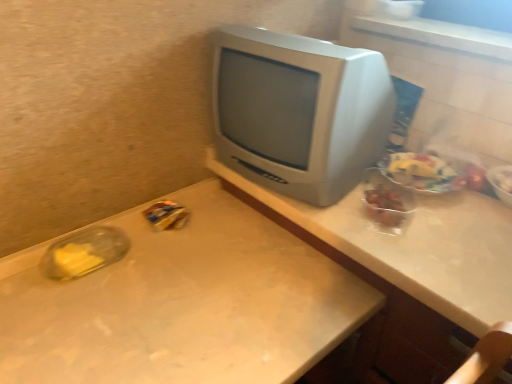
Question: From a real-world perspective, is translucent plastic container at right, which is counted as the third food, starting from the right, on translucent plastic bowl at upper right, the fourth food in the left-to-right sequence?

Choices:
 (A) yes
 (B) no

Answer: (B)

Question: Considering the relative sizes of translucent plastic container at right, which appears as the 2th food when viewed from the left, and translucent plastic bowl at upper right, the fourth food in the left-to-right sequence, in the image provided, is translucent plastic container at right, which appears as the 2th food when viewed from the left, taller than translucent plastic bowl at upper right, the fourth food in the left-to-right sequence,?

Choices:
 (A) no
 (B) yes

Answer: (A)

Question: From the image's perspective, is translucent plastic container at right, which appears as the 2th food when viewed from the left, on top of translucent plastic bowl at upper right, the fourth food in the left-to-right sequence?

Choices:
 (A) no
 (B) yes

Answer: (A)

Question: Can you confirm if translucent plastic container at right, which appears as the 2th food when viewed from the left, is thinner than translucent plastic bowl at upper right, the 1th food in the right-to-left sequence?

Choices:
 (A) no
 (B) yes

Answer: (A)

Question: Does translucent plastic container at right, which is counted as the third food, starting from the right, appear on the left side of translucent plastic bowl at upper right, the fourth food in the left-to-right sequence?

Choices:
 (A) yes
 (B) no

Answer: (A)

Question: Does translucent plastic container at right, which is counted as the third food, starting from the right, have a greater width compared to translucent plastic bowl at upper right, the fourth food in the left-to-right sequence?

Choices:
 (A) yes
 (B) no

Answer: (A)

Question: Would you say translucent plastic bowl at upper right, the fourth food in the left-to-right sequence, is a long distance from yellow plastic bag at center-left, which appears as the 4th food when viewed from the right?

Choices:
 (A) yes
 (B) no

Answer: (B)

Question: Is translucent plastic bowl at upper right, the 1th food in the right-to-left sequence, facing away from yellow plastic bag at center-left, which appears as the 4th food when viewed from the right?

Choices:
 (A) yes
 (B) no

Answer: (B)

Question: From the image's perspective, does translucent plastic bowl at upper right, the fourth food in the left-to-right sequence, appear higher than yellow plastic bag at center-left, which is counted as the first food, starting from the left?

Choices:
 (A) no
 (B) yes

Answer: (B)

Question: Can you see translucent plastic bowl at upper right, the fourth food in the left-to-right sequence, touching yellow plastic bag at center-left, which appears as the 4th food when viewed from the right?

Choices:
 (A) no
 (B) yes

Answer: (A)

Question: From a real-world perspective, is translucent plastic bowl at upper right, the fourth food in the left-to-right sequence, positioned under yellow plastic bag at center-left, which is counted as the first food, starting from the left, based on gravity?

Choices:
 (A) yes
 (B) no

Answer: (B)

Question: Can you confirm if translucent plastic bowl at upper right, the 1th food in the right-to-left sequence, is taller than yellow plastic bag at center-left, which is counted as the first food, starting from the left?

Choices:
 (A) no
 (B) yes

Answer: (A)

Question: Is matte gray computer desk at center outside of satin silver monitor at center?

Choices:
 (A) no
 (B) yes

Answer: (B)